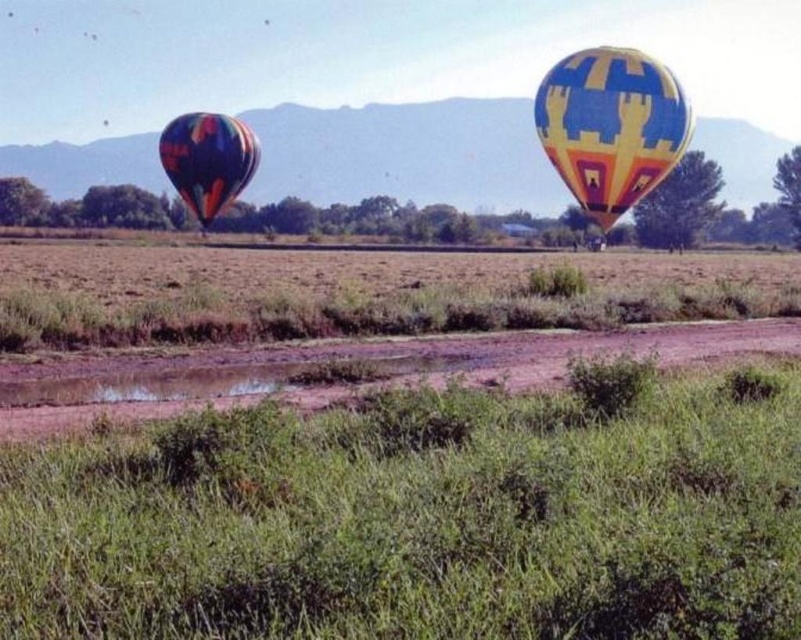
You are an observer standing on the grassy field looking up at the two hot air balloons. Which balloon is positioned closer to you, the yellow and blue patterned hot air balloon at upper right or the multicolored fabric balloon at left?

The yellow and blue patterned hot air balloon at upper right is closer to the viewer than the multicolored fabric balloon at left.

You are standing in the middle of the grassy field and see the point marked as point (610, 125). What object is located at this point?

The yellow and blue patterned hot air balloon at upper right is located at point (610, 125).